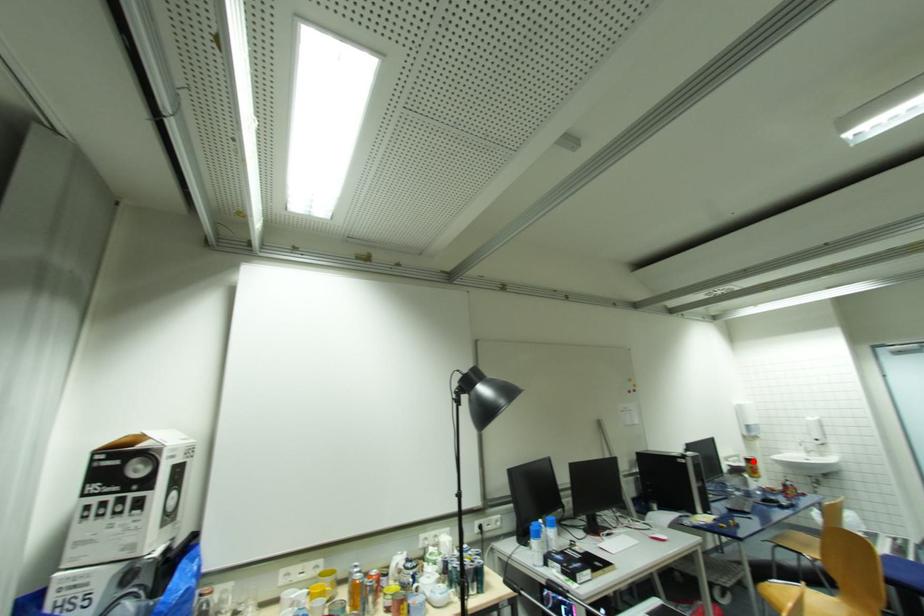
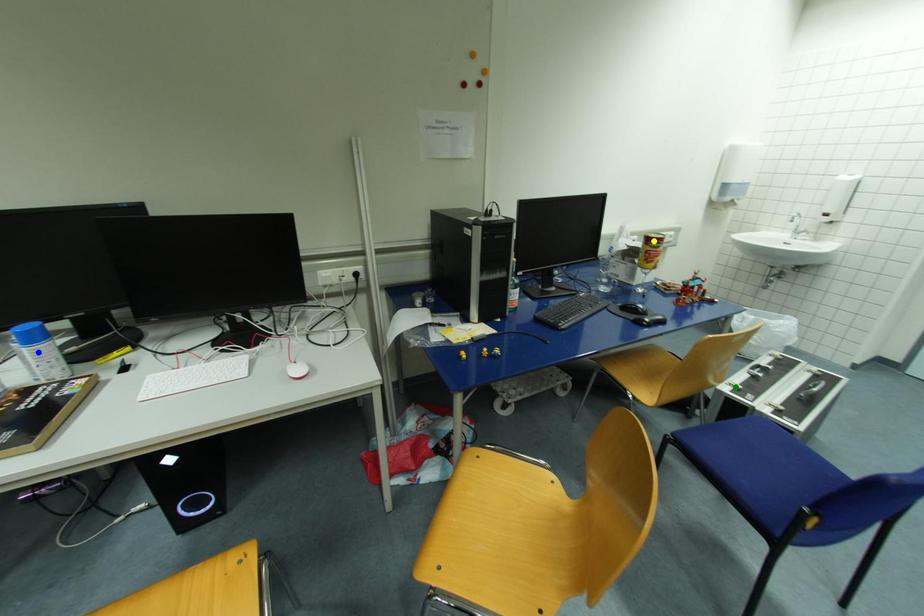
Question: I am providing you with two images of the same scene from different viewpoints. A red point is marked on the first image. You are given multiple points on the second image. Which mark in image 2 goes with the point in image 1?

Choices:
 (A) blue point
 (B) green point
 (C) yellow point

Answer: (C)